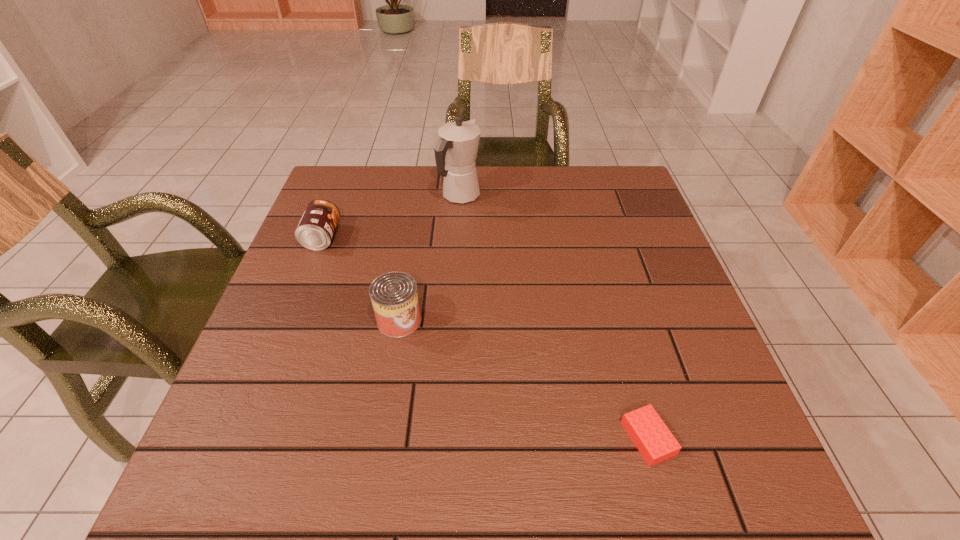
Find the location of a particular element. coffeepot is located at coordinates (457, 146).

The image size is (960, 540). I want to click on the third object from left to right, so [457, 146].

Locate an element on the screen. the right can is located at coordinates (394, 296).

The width and height of the screenshot is (960, 540). In order to click on the third object from right to left in this screenshot , I will do `click(394, 296)`.

Identify the location of the leftmost object. (315, 230).

This screenshot has height=540, width=960. Identify the location of the shorter can. (315, 230).

This screenshot has width=960, height=540. Identify the location of the rightmost object. (655, 442).

I want to click on the shortest object, so click(655, 442).

Find the location of a particular element. The image size is (960, 540). vacant space located on the left of the farthest object is located at coordinates (352, 196).

This screenshot has width=960, height=540. Find the location of `vacant point located 0.150m on the left of the third shortest object`. vacant point located 0.150m on the left of the third shortest object is located at coordinates (306, 320).